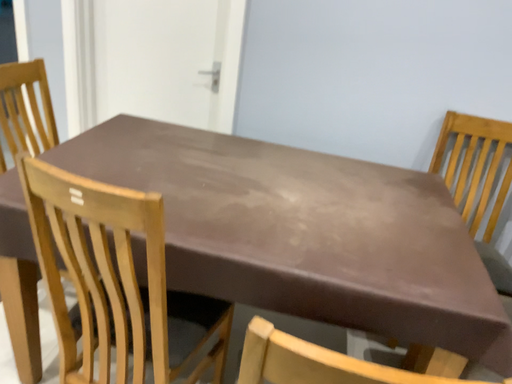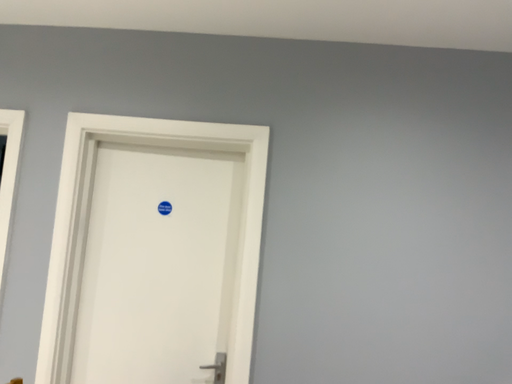
Question: Which way did the camera rotate in the video?

Choices:
 (A) rotated right
 (B) rotated left

Answer: (A)